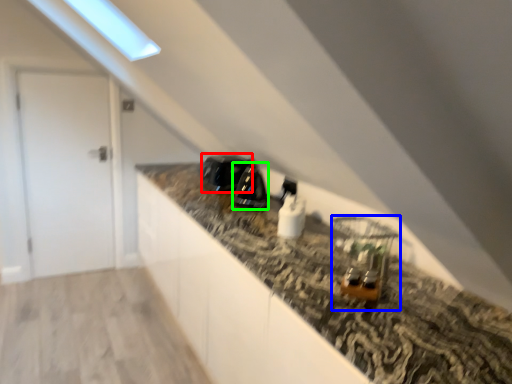
Question: Which object is positioned farthest from appliance (highlighted by a red box)? Select from appliance (highlighted by a blue box) and appliance (highlighted by a green box).

Choices:
 (A) appliance
 (B) appliance

Answer: (A)